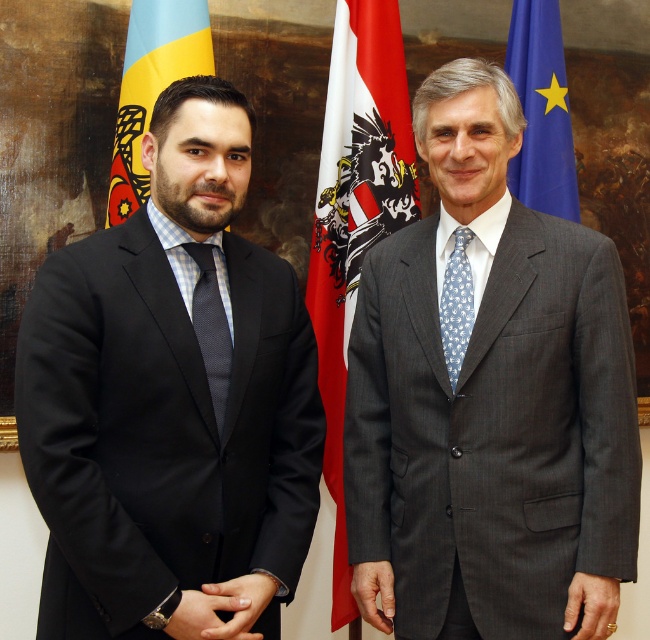
Does gray textured suit at center have a smaller size compared to black matte suit at left?

No, gray textured suit at center is not smaller than black matte suit at left.

Does gray textured suit at center appear under black matte suit at left?

No.

The width and height of the screenshot is (650, 640). What do you see at coordinates (489, 401) in the screenshot?
I see `gray textured suit at center` at bounding box center [489, 401].

Identify the location of gray textured suit at center. (489, 401).

Between black matte suit at left and red/white fabric flag at center, which one is positioned lower?

black matte suit at left is lower down.

Find the location of `black matte suit at left`. black matte suit at left is located at coordinates (172, 401).

Identify the location of black matte suit at left. point(172,401).

Is black matte suit at left behind blue dotted fabric tie at center?

No, black matte suit at left is closer to the viewer.

Between black matte suit at left and blue dotted fabric tie at center, which one is positioned higher?

blue dotted fabric tie at center

You are a GUI agent. You are given a task and a screenshot of the screen. Output one action in this format:
    pyautogui.click(x=<x>, y=<y>)
    Task: Click on the black matte suit at left
    Image resolution: width=650 pixels, height=640 pixels.
    Given the screenshot: What is the action you would take?
    pyautogui.click(x=172, y=401)